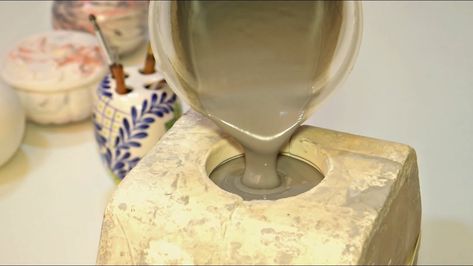
Where is `vase red black`? vase red black is located at coordinates (108, 25).